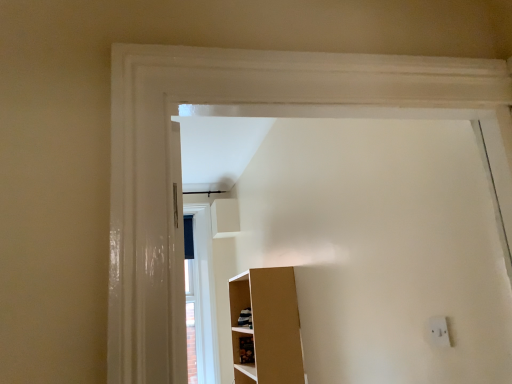
Find the location of a particular element. The height and width of the screenshot is (384, 512). white plastic electric outlet at lower right is located at coordinates (439, 331).

What do you see at coordinates (439, 331) in the screenshot?
I see `white plastic electric outlet at lower right` at bounding box center [439, 331].

The height and width of the screenshot is (384, 512). What do you see at coordinates (246, 350) in the screenshot? I see `wooden cabinet at lower center` at bounding box center [246, 350].

Find the location of `wooden cabinet at lower center`. wooden cabinet at lower center is located at coordinates point(246,350).

Locate an element on the screen. white plastic electric outlet at lower right is located at coordinates (439, 331).

Considering the relative positions of wooden cabinet at lower center and white plastic electric outlet at lower right in the image provided, is wooden cabinet at lower center to the right of white plastic electric outlet at lower right from the viewer's perspective?

Incorrect, wooden cabinet at lower center is not on the right side of white plastic electric outlet at lower right.

Does wooden cabinet at lower center lie behind white plastic electric outlet at lower right?

That is True.

Which is closer to the camera, (245, 356) or (432, 327)?

Point (245, 356) appears to be farther away from the viewer than point (432, 327).

From the image's perspective, relative to white plastic electric outlet at lower right, is wooden cabinet at lower center above or below?

Clearly, from the image's perspective, wooden cabinet at lower center is below white plastic electric outlet at lower right.

From a real-world perspective, which object stands above the other?

From a 3D spatial view, white plastic electric outlet at lower right is above.

Does wooden cabinet at lower center have a greater width compared to white plastic electric outlet at lower right?

Correct, the width of wooden cabinet at lower center exceeds that of white plastic electric outlet at lower right.

Considering the relative sizes of wooden cabinet at lower center and white plastic electric outlet at lower right in the image provided, is wooden cabinet at lower center shorter than white plastic electric outlet at lower right?

No, wooden cabinet at lower center is not shorter than white plastic electric outlet at lower right.

Considering the sizes of objects wooden cabinet at lower center and white plastic electric outlet at lower right in the image provided, who is smaller, wooden cabinet at lower center or white plastic electric outlet at lower right?

white plastic electric outlet at lower right.

Would you say wooden cabinet at lower center is outside white plastic electric outlet at lower right?

wooden cabinet at lower center lies outside white plastic electric outlet at lower right's area.

In the scene shown: Can you see wooden cabinet at lower center touching white plastic electric outlet at lower right?

No, wooden cabinet at lower center is not touching white plastic electric outlet at lower right.

Is wooden cabinet at lower center oriented away from white plastic electric outlet at lower right?

No.

Can you tell me how much wooden cabinet at lower center and white plastic electric outlet at lower right differ in facing direction?

wooden cabinet at lower center and white plastic electric outlet at lower right are facing 0.0111 degrees away from each other.

The image size is (512, 384). Identify the location of electric outlet on the right of wooden cabinet at lower center. pos(439,331).

Is white plastic electric outlet at lower right to the right of wooden cabinet at lower center from the viewer's perspective?

Correct, you'll find white plastic electric outlet at lower right to the right of wooden cabinet at lower center.

Is the position of white plastic electric outlet at lower right less distant than that of wooden cabinet at lower center?

Yes, white plastic electric outlet at lower right is in front of wooden cabinet at lower center.

Does point (443, 343) come in front of point (251, 342)?

Yes, point (443, 343) is closer to viewer.

From the image's perspective, who appears lower, white plastic electric outlet at lower right or wooden cabinet at lower center?

From the image's view, wooden cabinet at lower center is below.

From a real-world perspective, is white plastic electric outlet at lower right located beneath wooden cabinet at lower center?

No.

Which of these two, white plastic electric outlet at lower right or wooden cabinet at lower center, is wider?

Wider between the two is wooden cabinet at lower center.

Can you confirm if white plastic electric outlet at lower right is taller than wooden cabinet at lower center?

No.

Looking at the image, does white plastic electric outlet at lower right seem bigger or smaller compared to wooden cabinet at lower center?

Clearly, white plastic electric outlet at lower right is smaller in size than wooden cabinet at lower center.

Consider the image. Is wooden cabinet at lower center a part of white plastic electric outlet at lower right?

No, wooden cabinet at lower center is not surrounded by white plastic electric outlet at lower right.

Are white plastic electric outlet at lower right and wooden cabinet at lower center making contact?

No, white plastic electric outlet at lower right is not in contact with wooden cabinet at lower center.

Is white plastic electric outlet at lower right facing towards wooden cabinet at lower center?

No, white plastic electric outlet at lower right does not turn towards wooden cabinet at lower center.

Can you tell me how much white plastic electric outlet at lower right and wooden cabinet at lower center differ in facing direction?

The facing directions of white plastic electric outlet at lower right and wooden cabinet at lower center are 0.0111 degrees apart.

Find the location of a particular element. The height and width of the screenshot is (384, 512). cabinet on the left side of white plastic electric outlet at lower right is located at coordinates (246, 350).

The height and width of the screenshot is (384, 512). I want to click on cabinet behind the white plastic electric outlet at lower right, so pos(246,350).

The height and width of the screenshot is (384, 512). What are the coordinates of `cabinet on the left of white plastic electric outlet at lower right` in the screenshot? It's located at tap(246, 350).